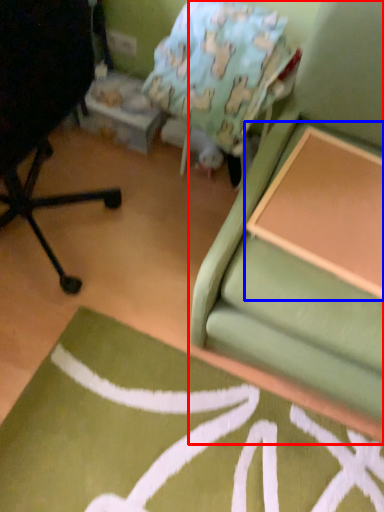
Question: Which object appears farthest to the camera in this image, studio couch (highlighted by a red box) or table (highlighted by a blue box)?

Choices:
 (A) studio couch
 (B) table

Answer: (B)